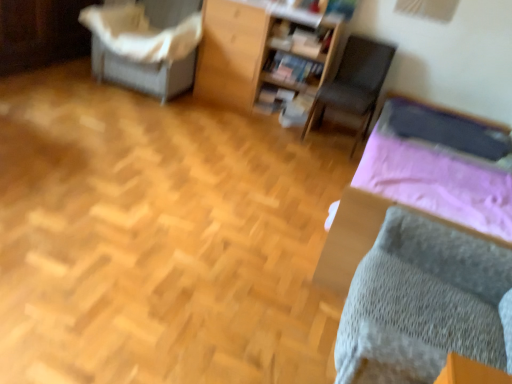
Find the location of a particular element. This screenshot has width=512, height=384. vacant area that lies between white fabric-covered chair at upper left, the 2th furniture in the right-to-left sequence, and wooden bookshelf at upper center, arranged as the second furniture when viewed from the left is located at coordinates (210, 106).